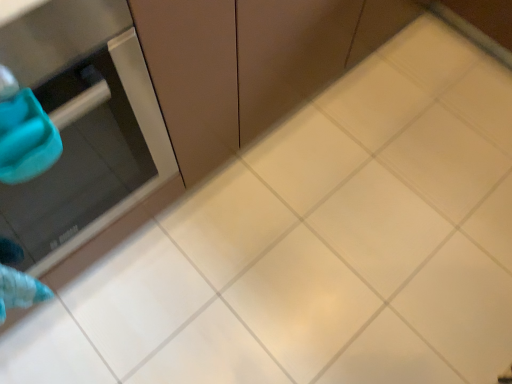
Question: In terms of width, does stainless steel oven at left look wider or thinner when compared to matte brown cabinet at center?

Choices:
 (A) thin
 (B) wide

Answer: (B)

Question: Does point (83, 134) appear closer or farther from the camera than point (166, 112)?

Choices:
 (A) closer
 (B) farther

Answer: (A)

Question: Is stainless steel oven at left spatially inside matte brown cabinet at center, or outside of it?

Choices:
 (A) outside
 (B) inside

Answer: (A)

Question: Is matte brown cabinet at center in front of or behind stainless steel oven at left in the image?

Choices:
 (A) front
 (B) behind

Answer: (B)

Question: In the image, is matte brown cabinet at center on the left side or the right side of stainless steel oven at left?

Choices:
 (A) left
 (B) right

Answer: (B)

Question: Considering the positions of matte brown cabinet at center and stainless steel oven at left in the image, is matte brown cabinet at center taller or shorter than stainless steel oven at left?

Choices:
 (A) short
 (B) tall

Answer: (A)

Question: Does point (242, 87) appear closer or farther from the camera than point (28, 74)?

Choices:
 (A) closer
 (B) farther

Answer: (B)